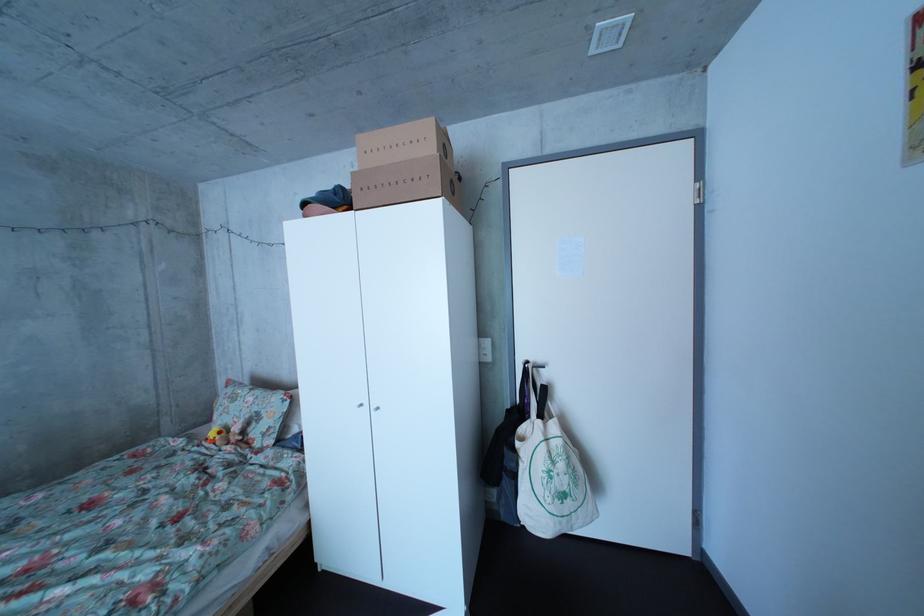
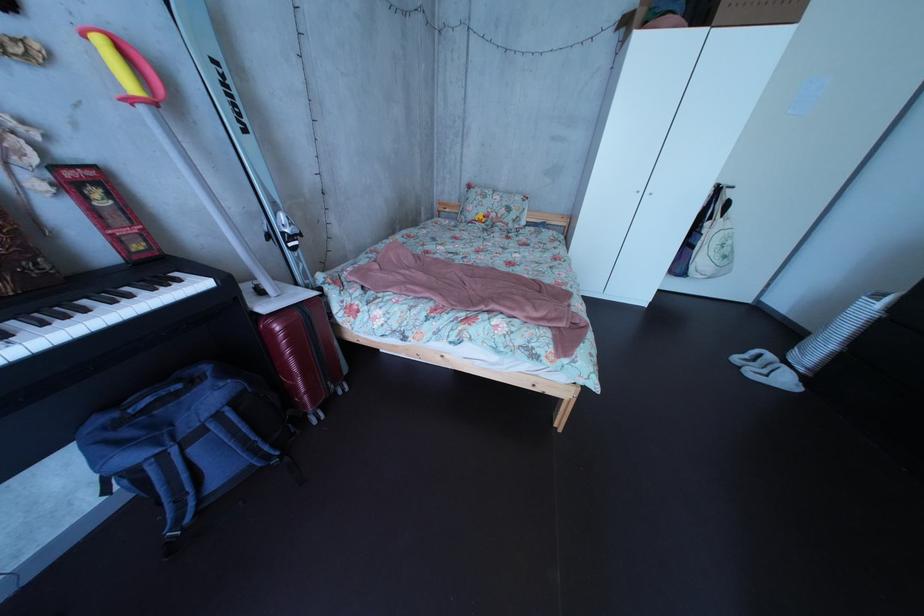
In the second image, find the point that corresponds to pixel 247 415 in the first image.

(499, 209)